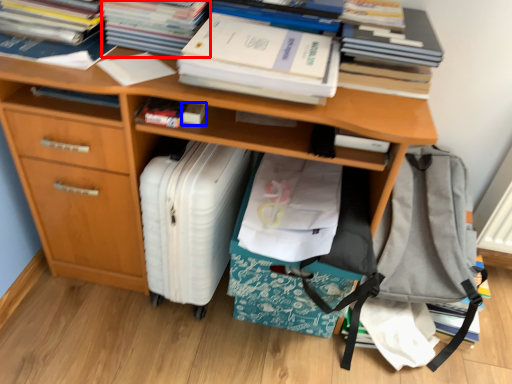
Question: Which object appears closest to the camera in this image, paperback book (highlighted by a red box) or book (highlighted by a blue box)?

Choices:
 (A) paperback book
 (B) book

Answer: (A)